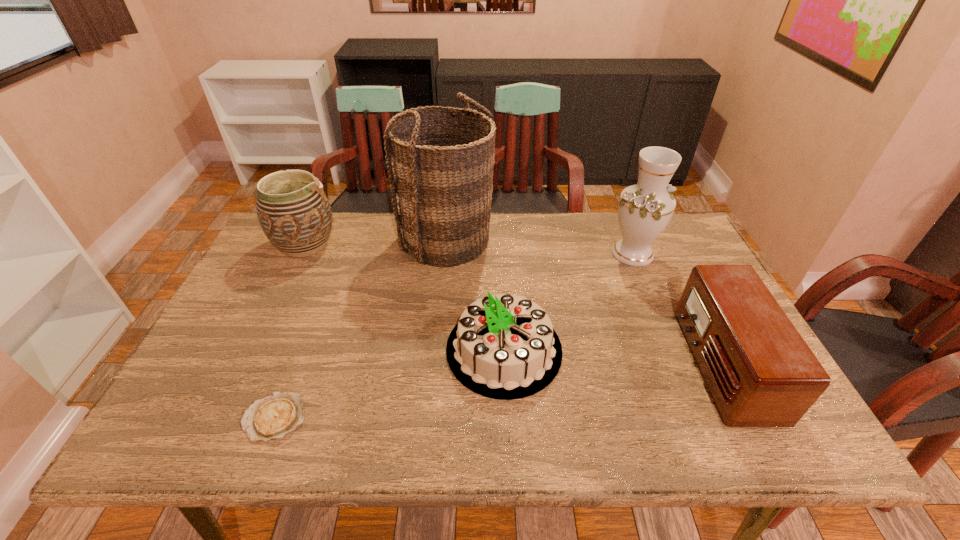
Image resolution: width=960 pixels, height=540 pixels. Identify the location of vacant position located 0.380m on the front-facing side of the radio receiver. (531, 364).

Where is `vacant space located on the front-facing side of the radio receiver`? vacant space located on the front-facing side of the radio receiver is located at coordinates (648, 364).

The width and height of the screenshot is (960, 540). I want to click on free space located on the front-facing side of the radio receiver, so click(614, 364).

This screenshot has height=540, width=960. Find the location of `vacant position located 0.150m on the left of the quiche`. vacant position located 0.150m on the left of the quiche is located at coordinates (174, 417).

This screenshot has width=960, height=540. I want to click on basket that is at the far edge, so click(x=441, y=175).

Where is `vase that is at the far edge`? This screenshot has height=540, width=960. vase that is at the far edge is located at coordinates (644, 210).

The width and height of the screenshot is (960, 540). I want to click on pottery that is at the far edge, so click(293, 210).

Find the location of a particular element. radio receiver that is at the near edge is located at coordinates (761, 373).

The width and height of the screenshot is (960, 540). Find the location of `quiche present at the near edge`. quiche present at the near edge is located at coordinates (280, 413).

Find the location of a particular element. The height and width of the screenshot is (540, 960). object present at the left edge is located at coordinates (293, 210).